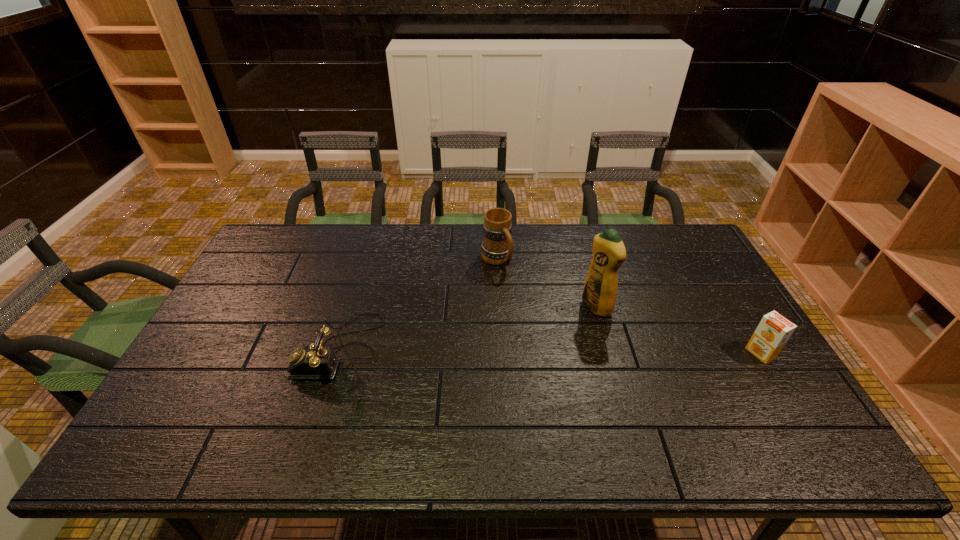
Image resolution: width=960 pixels, height=540 pixels. Find the location of `free space on the desktop that is between the telephone and the orange juice and is positioned on the label of the second object from right to left`. free space on the desktop that is between the telephone and the orange juice and is positioned on the label of the second object from right to left is located at coordinates (522, 350).

This screenshot has width=960, height=540. I want to click on free space on the desktop that is between the telephone and the rightmost object and is positioned on the side of the second object from left to right with the handle, so click(x=571, y=351).